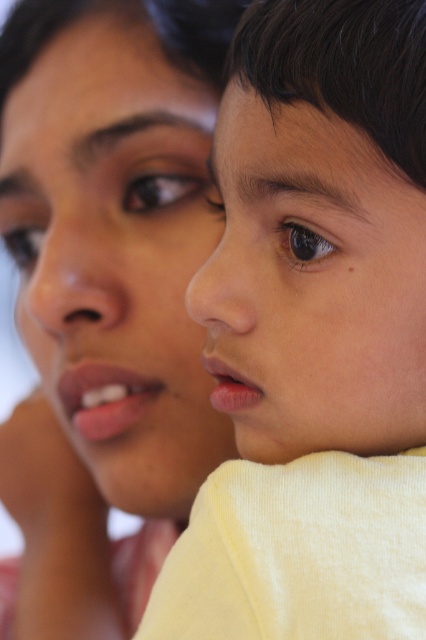
Between smooth skin face at upper left and smooth skin face at center, which one appears on the left side from the viewer's perspective?

From the viewer's perspective, smooth skin face at upper left appears more on the left side.

Is smooth skin face at upper left below smooth skin face at center?

No, smooth skin face at upper left is not below smooth skin face at center.

Is point (190, 480) positioned after point (357, 189)?

Yes, it is behind point (357, 189).

At what (x,y) coordinates should I click in order to perform the action: click on smooth skin face at upper left. Please return your answer as a coordinate pair (x, y). This screenshot has height=640, width=426. Looking at the image, I should click on (115, 256).

Is point (224, 488) behind point (241, 454)?

No, (224, 488) is in front of (241, 454).

Find the location of a particular element. smooth cream sweater at right is located at coordinates (313, 337).

Image resolution: width=426 pixels, height=640 pixels. Find the location of `smooth cream sweater at right`. smooth cream sweater at right is located at coordinates (313, 337).

Which is more to the left, smooth cream sweater at right or smooth skin face at upper left?

Positioned to the left is smooth skin face at upper left.

Between smooth cream sweater at right and smooth skin face at upper left, which one is positioned higher?

Positioned higher is smooth skin face at upper left.

You are a GUI agent. You are given a task and a screenshot of the screen. Output one action in this format:
    pyautogui.click(x=<x>, y=<y>)
    Task: Click on the smooth cream sweater at right
    The image size is (426, 640).
    Given the screenshot: What is the action you would take?
    pyautogui.click(x=313, y=337)